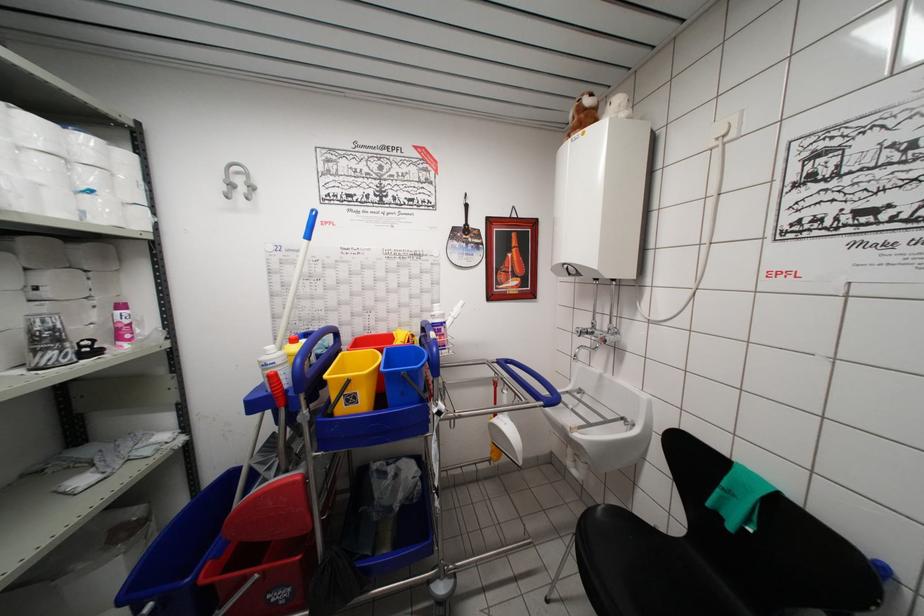
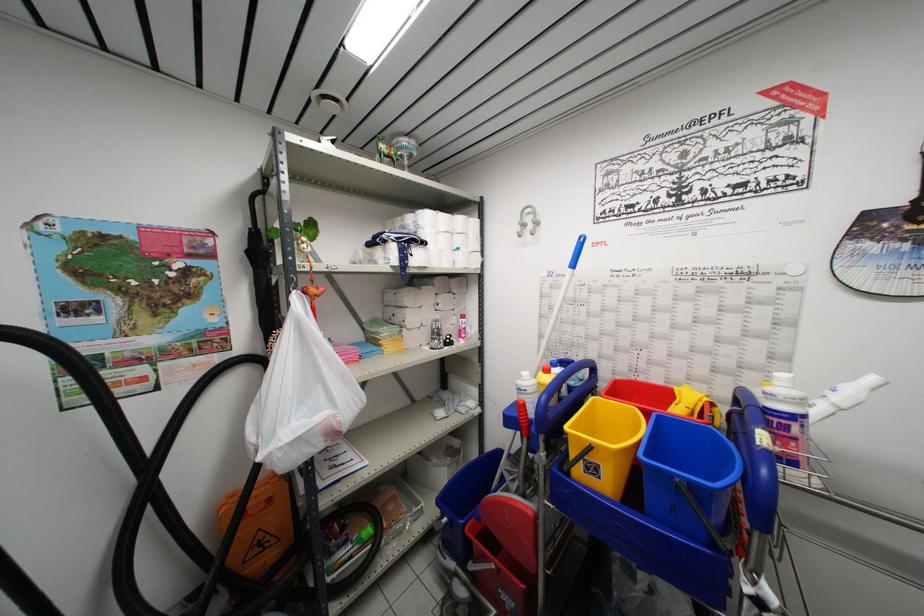
Question: The first image is from the beginning of the video and the second image is from the end. How did the camera likely rotate when shooting the video?

Choices:
 (A) Left
 (B) Right
 (C) Up
 (D) Down

Answer: (A)